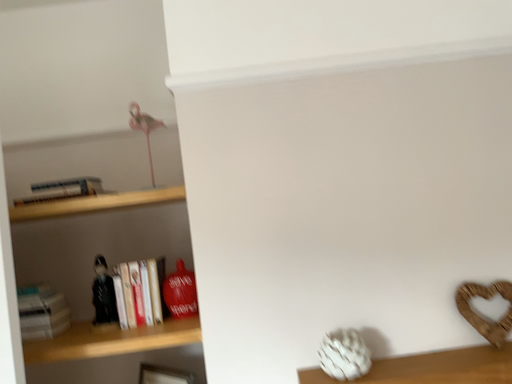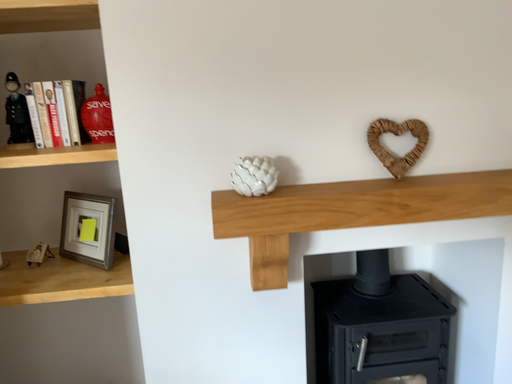
Question: Which way did the camera rotate in the video?

Choices:
 (A) rotated downward
 (B) rotated upward

Answer: (A)